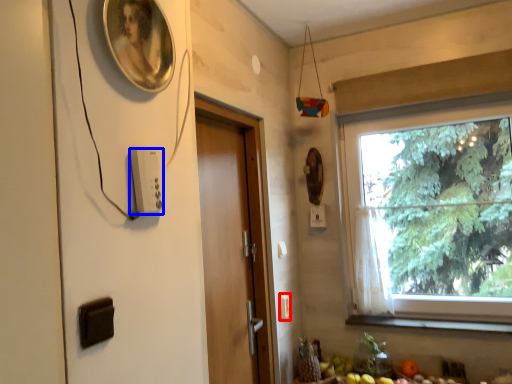
Question: Which point is closer to the camera, light switch (highlighted by a red box) or light switch (highlighted by a blue box)?

Choices:
 (A) light switch
 (B) light switch

Answer: (B)